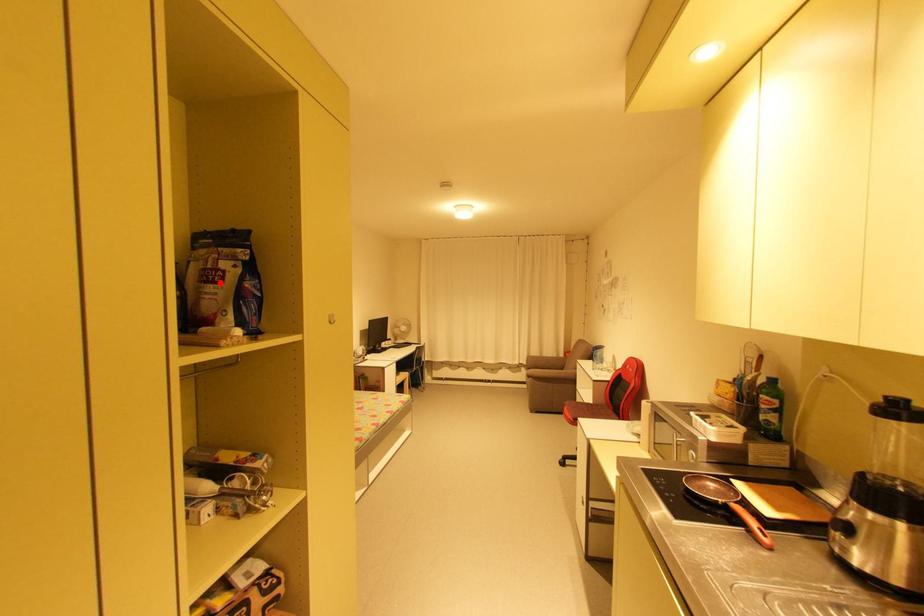
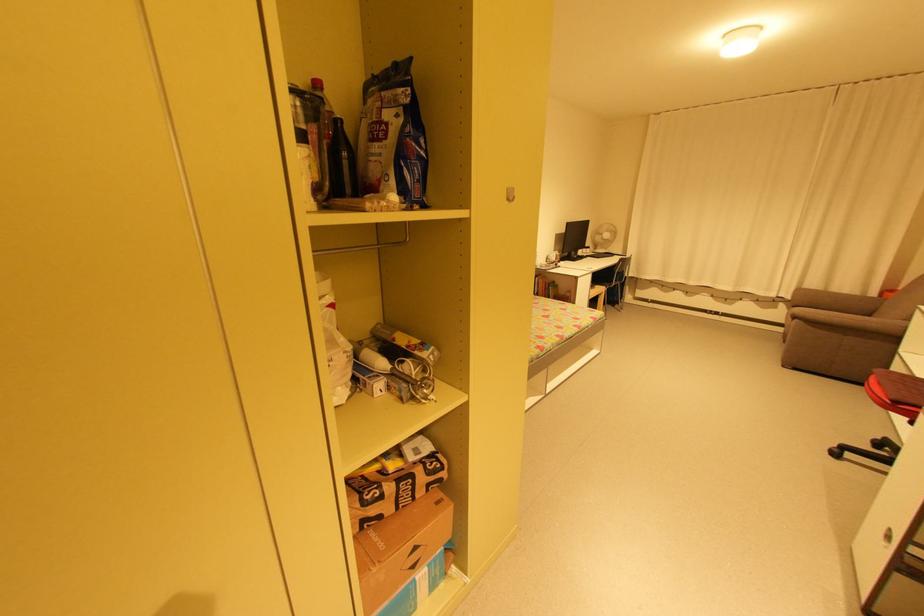
In the second image, find the point that corresponds to the highlighted location in the first image.

(383, 140)